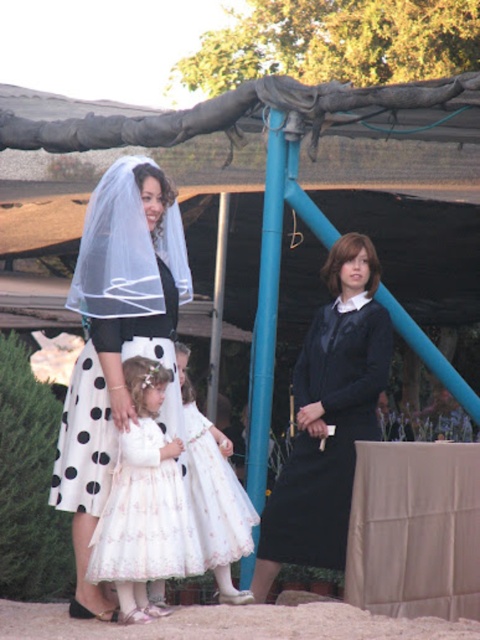
Consider the image. You are standing at the point with coordinates point (186,525) and want to walk to the point with coordinates point (263,563). Which direction should you move in to reach your destination?

To reach point (263,563) from point (186,525), you should move backward since point (263,563) is behind point (186,525).

You are a photographer at the event and need to ensure both the matte black dress at center and the white satin dress at center are visible in your photo. Based on their positions, which dress is positioned higher in the frame?

The matte black dress at center is located above the white satin dress at center, so it is positioned higher in the frame.

Consider the image. You are a photographer at the event and need to capture a closeup shot of the white lace dress at center without the white sheer veil at upper left overlapping. Is this possible given their sizes?

The white sheer veil at upper left is bigger than the white lace dress at center, so it might overlap and block the view. Adjust your angle or position to ensure the veil doesn not cover the dress.